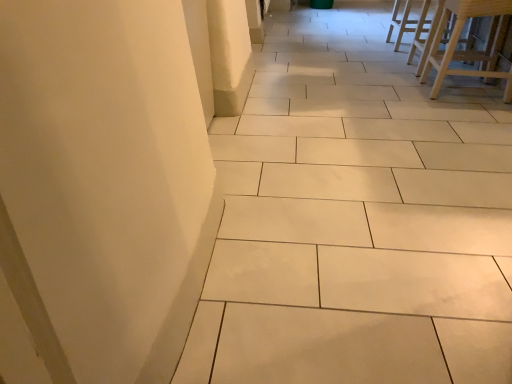
What do you see at coordinates (468, 51) in the screenshot?
I see `light wood stool at upper right, which appears as the 1th furniture when ordered from the bottom` at bounding box center [468, 51].

Locate an element on the screen. light wood stool at upper right, which appears as the 1th furniture when ordered from the bottom is located at coordinates (468, 51).

Measure the distance between point (408, 29) and camera.

Point (408, 29) is 11.44 feet from camera.

Image resolution: width=512 pixels, height=384 pixels. What are the coordinates of `light brown wooden stool at upper right, which is the second furniture in bottom-to-top order` in the screenshot? It's located at (406, 22).

The height and width of the screenshot is (384, 512). What do you see at coordinates (406, 22) in the screenshot? I see `light brown wooden stool at upper right, which appears as the 1th furniture when viewed from the back` at bounding box center [406, 22].

Locate an element on the screen. light wood stool at upper right, arranged as the 2th furniture when viewed from the back is located at coordinates (468, 51).

Does light brown wooden stool at upper right, which appears as the 1th furniture when viewed from the back, appear on the left side of light wood stool at upper right, arranged as the 2th furniture when viewed from the back?

No.

In the scene shown: Considering the relative positions of light brown wooden stool at upper right, which is the second furniture in bottom-to-top order, and light wood stool at upper right, which is the 1th furniture from front to back, in the image provided, is light brown wooden stool at upper right, which is the second furniture in bottom-to-top order, behind light wood stool at upper right, which is the 1th furniture from front to back,?

Yes, light brown wooden stool at upper right, which is the second furniture in bottom-to-top order, is further from the viewer.

From the picture: Which is less distant, [404,30] or [488,1]?

Point [404,30].

From the image's perspective, between light brown wooden stool at upper right, which appears as the 1th furniture when viewed from the back, and light wood stool at upper right, which appears as the 1th furniture when ordered from the bottom, which one is located above?

light brown wooden stool at upper right, which appears as the 1th furniture when viewed from the back.

From a real-world perspective, is light brown wooden stool at upper right, which is the second furniture in bottom-to-top order, physically located above or below light wood stool at upper right, which is the 1th furniture from front to back?

From a real-world perspective, light brown wooden stool at upper right, which is the second furniture in bottom-to-top order, is physically below light wood stool at upper right, which is the 1th furniture from front to back.

Looking at this image, can you confirm if light brown wooden stool at upper right, which appears as the 1th furniture when viewed from the back, is thinner than light wood stool at upper right, arranged as the 2th furniture when viewed from the back?

Yes, light brown wooden stool at upper right, which appears as the 1th furniture when viewed from the back, is thinner than light wood stool at upper right, arranged as the 2th furniture when viewed from the back.

Who is shorter, light brown wooden stool at upper right, which appears as the 1th furniture when viewed from the back, or light wood stool at upper right, the second furniture from the top?

light brown wooden stool at upper right, which appears as the 1th furniture when viewed from the back, is shorter.

Is light brown wooden stool at upper right, which appears as the 1th furniture when viewed from the back, bigger or smaller than light wood stool at upper right, which appears as the 1th furniture when ordered from the bottom?

In the image, light brown wooden stool at upper right, which appears as the 1th furniture when viewed from the back, appears to be smaller than light wood stool at upper right, which appears as the 1th furniture when ordered from the bottom.

Is light brown wooden stool at upper right, the first furniture in the top-to-bottom sequence, positioned beyond the bounds of light wood stool at upper right, which appears as the 1th furniture when ordered from the bottom?

light brown wooden stool at upper right, the first furniture in the top-to-bottom sequence, lies outside light wood stool at upper right, which appears as the 1th furniture when ordered from the bottom,'s area.

Does light brown wooden stool at upper right, which appears as the 1th furniture when viewed from the back, touch light wood stool at upper right, which is the 1th furniture from front to back?

No.

Is light brown wooden stool at upper right, which is the second furniture in bottom-to-top order, oriented towards light wood stool at upper right, which is the 1th furniture from front to back?

No, light brown wooden stool at upper right, which is the second furniture in bottom-to-top order, is not turned towards light wood stool at upper right, which is the 1th furniture from front to back.

You are a GUI agent. You are given a task and a screenshot of the screen. Output one action in this format:
    pyautogui.click(x=<x>, y=<y>)
    Task: Click on the furniture that is under the light wood stool at upper right, which is the 1th furniture from front to back (from a real-world perspective)
    This screenshot has height=384, width=512.
    Given the screenshot: What is the action you would take?
    pyautogui.click(x=406, y=22)

Is light wood stool at upper right, which is the 1th furniture from front to back, at the right side of light brown wooden stool at upper right, which is the second furniture in bottom-to-top order?

No, light wood stool at upper right, which is the 1th furniture from front to back, is not to the right of light brown wooden stool at upper right, which is the second furniture in bottom-to-top order.

From the picture: Is light wood stool at upper right, the second furniture from the top, positioned in front of light brown wooden stool at upper right, arranged as the 2th furniture when viewed from the front?

Yes, it is.

Is point (468, 7) closer or farther from the camera than point (398, 46)?

Point (468, 7).

From the image's perspective, does light wood stool at upper right, the second furniture from the top, appear higher than light brown wooden stool at upper right, the first furniture in the top-to-bottom sequence?

No, from the image's perspective, light wood stool at upper right, the second furniture from the top, is not above light brown wooden stool at upper right, the first furniture in the top-to-bottom sequence.

From a real-world perspective, is light wood stool at upper right, which appears as the 1th furniture when ordered from the bottom, under light brown wooden stool at upper right, arranged as the 2th furniture when viewed from the front?

No, from a real-world perspective, light wood stool at upper right, which appears as the 1th furniture when ordered from the bottom, is not under light brown wooden stool at upper right, arranged as the 2th furniture when viewed from the front.

Can you confirm if light wood stool at upper right, arranged as the 2th furniture when viewed from the back, is wider than light brown wooden stool at upper right, arranged as the 2th furniture when viewed from the front?

Yes.

Can you confirm if light wood stool at upper right, arranged as the 2th furniture when viewed from the back, is shorter than light brown wooden stool at upper right, which appears as the 1th furniture when viewed from the back?

No.

Who is smaller, light wood stool at upper right, which appears as the 1th furniture when ordered from the bottom, or light brown wooden stool at upper right, which is the second furniture in bottom-to-top order?

Smaller between the two is light brown wooden stool at upper right, which is the second furniture in bottom-to-top order.

Does light wood stool at upper right, arranged as the 2th furniture when viewed from the back, contain light brown wooden stool at upper right, which is the second furniture in bottom-to-top order?

No, light brown wooden stool at upper right, which is the second furniture in bottom-to-top order, is not a part of light wood stool at upper right, arranged as the 2th furniture when viewed from the back.

Is light wood stool at upper right, which appears as the 1th furniture when ordered from the bottom, placed right next to light brown wooden stool at upper right, the first furniture in the top-to-bottom sequence?

No, light wood stool at upper right, which appears as the 1th furniture when ordered from the bottom, is not next to light brown wooden stool at upper right, the first furniture in the top-to-bottom sequence.

Is light wood stool at upper right, arranged as the 2th furniture when viewed from the back, oriented towards light brown wooden stool at upper right, which appears as the 1th furniture when viewed from the back?

No.

What's the angular difference between light wood stool at upper right, arranged as the 2th furniture when viewed from the back, and light brown wooden stool at upper right, the first furniture in the top-to-bottom sequence,'s facing directions?

There is a 2.5-degree angle between the facing directions of light wood stool at upper right, arranged as the 2th furniture when viewed from the back, and light brown wooden stool at upper right, the first furniture in the top-to-bottom sequence.

This screenshot has width=512, height=384. I want to click on furniture behind the light wood stool at upper right, which appears as the 1th furniture when ordered from the bottom, so click(406, 22).

I want to click on furniture that appears above the light wood stool at upper right, which appears as the 1th furniture when ordered from the bottom (from the image's perspective), so click(x=406, y=22).

You are a GUI agent. You are given a task and a screenshot of the screen. Output one action in this format:
    pyautogui.click(x=<x>, y=<y>)
    Task: Click on the furniture that appears below the light brown wooden stool at upper right, which appears as the 1th furniture when viewed from the back (from the image's perspective)
    
    Given the screenshot: What is the action you would take?
    pyautogui.click(x=468, y=51)